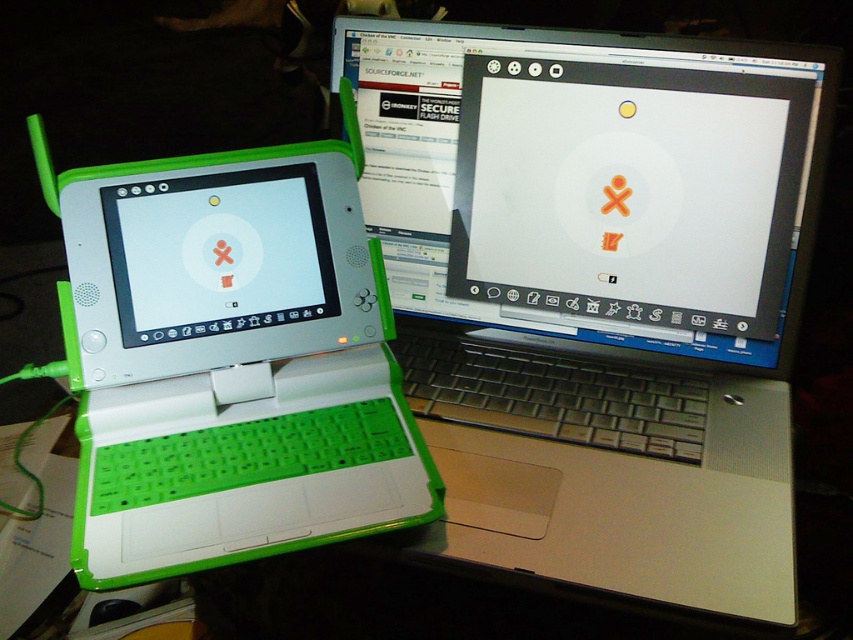
Is green matte laptop at left thinner than white matte screen at left?

In fact, green matte laptop at left might be wider than white matte screen at left.

This screenshot has width=853, height=640. What do you see at coordinates (229, 358) in the screenshot? I see `green matte laptop at left` at bounding box center [229, 358].

Find the location of a particular element. This screenshot has width=853, height=640. green matte laptop at left is located at coordinates (229, 358).

Looking at this image, can you confirm if green plastic laptop at center is positioned to the right of green matte laptop at left?

Indeed, green plastic laptop at center is positioned on the right side of green matte laptop at left.

Is point (671, 266) closer to viewer compared to point (102, 433)?

No, (671, 266) is further to viewer.

You are a GUI agent. You are given a task and a screenshot of the screen. Output one action in this format:
    pyautogui.click(x=<x>, y=<y>)
    Task: Click on the green plastic laptop at center
    This screenshot has height=640, width=853.
    Given the screenshot: What is the action you would take?
    pyautogui.click(x=607, y=317)

How far apart are green plastic laptop at center and white matte screen at left?

They are 10.09 inches apart.

Which of these two, green plastic laptop at center or white matte screen at left, stands shorter?

Standing shorter between the two is white matte screen at left.

Who is more distant from viewer, (x=448, y=436) or (x=233, y=250)?

The point (x=448, y=436) is more distant.

Locate an element on the screen. The height and width of the screenshot is (640, 853). green plastic laptop at center is located at coordinates (607, 317).